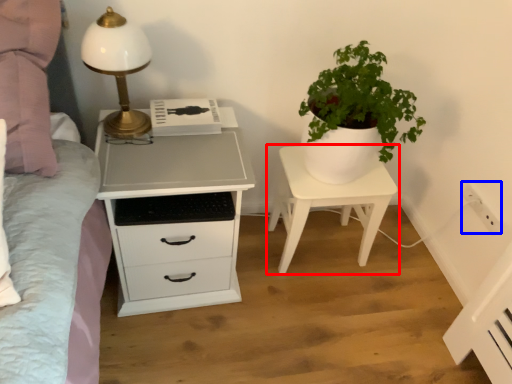
Question: Which point is further to the camera, nightstand (highlighted by a red box) or electric outlet (highlighted by a blue box)?

Choices:
 (A) nightstand
 (B) electric outlet

Answer: (B)